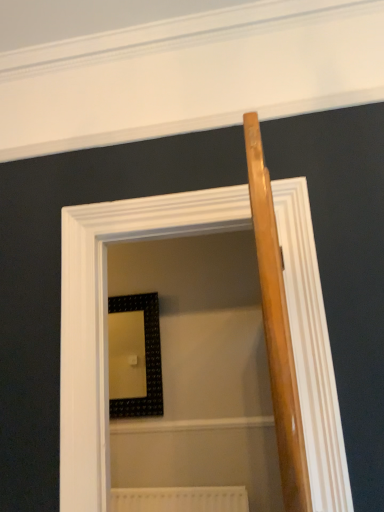
Question: From the image's perspective, is wooden screen door at center above or below black textured picture frame at center?

Choices:
 (A) below
 (B) above

Answer: (B)

Question: Considering the positions of point (317, 267) and point (109, 352), is point (317, 267) closer or farther from the camera than point (109, 352)?

Choices:
 (A) closer
 (B) farther

Answer: (A)

Question: Estimate the real-world distances between objects in this image. Which object is closer to the wooden screen door at center?

Choices:
 (A) white textured radiator at lower center
 (B) black textured picture frame at center

Answer: (A)

Question: Which object is the closest to the black textured picture frame at center?

Choices:
 (A) wooden screen door at center
 (B) white textured radiator at lower center

Answer: (B)